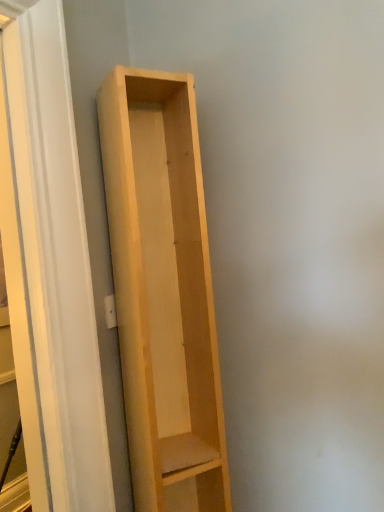
What do you see at coordinates (59, 259) in the screenshot?
I see `natural wood shelf at left` at bounding box center [59, 259].

Identify the location of natural wood shelf at left. The width and height of the screenshot is (384, 512). (59, 259).

Measure the distance between point (123, 140) and camera.

Point (123, 140) and camera are 1.00 meters apart from each other.

This screenshot has height=512, width=384. Identify the location of light wood shelf at center. (163, 291).

Image resolution: width=384 pixels, height=512 pixels. Describe the element at coordinates (163, 291) in the screenshot. I see `light wood shelf at center` at that location.

I want to click on natural wood shelf at left, so click(59, 259).

Can you confirm if light wood shelf at center is positioned to the right of natural wood shelf at left?

Correct, you'll find light wood shelf at center to the right of natural wood shelf at left.

Looking at this image, is light wood shelf at center positioned behind natural wood shelf at left?

Yes, it is behind natural wood shelf at left.

Between point (195, 360) and point (49, 36), which one is positioned behind?

The point (195, 360) is more distant.

From the image's perspective, is light wood shelf at center positioned above or below natural wood shelf at left?

light wood shelf at center is below natural wood shelf at left.

In the scene shown: From a real-world perspective, between light wood shelf at center and natural wood shelf at left, who is vertically higher?

natural wood shelf at left, from a real-world perspective.

Which object is thinner, light wood shelf at center or natural wood shelf at left?

With smaller width is natural wood shelf at left.

Who is shorter, light wood shelf at center or natural wood shelf at left?

With less height is light wood shelf at center.

Is light wood shelf at center bigger than natural wood shelf at left?

Correct, light wood shelf at center is larger in size than natural wood shelf at left.

Choose the correct answer: Is light wood shelf at center inside natural wood shelf at left or outside it?

light wood shelf at center is spatially situated outside natural wood shelf at left.

Are light wood shelf at center and natural wood shelf at left beside each other?

They are not placed beside each other.

Could you tell me if light wood shelf at center is facing natural wood shelf at left?

No, light wood shelf at center does not turn towards natural wood shelf at left.

This screenshot has height=512, width=384. I want to click on screen door above the light wood shelf at center (from a real-world perspective), so click(x=59, y=259).

Consider the image. In the image, is natural wood shelf at left on the left side or the right side of light wood shelf at center?

natural wood shelf at left is to the left of light wood shelf at center.

Is natural wood shelf at left closer to the viewer compared to light wood shelf at center?

Yes, it is in front of light wood shelf at center.

Is point (46, 429) positioned in front of point (203, 471)?

Yes.

From the image's perspective, which is above, natural wood shelf at left or light wood shelf at center?

From the image's view, natural wood shelf at left is above.

From a real-world perspective, between natural wood shelf at left and light wood shelf at center, who is vertically lower?

In real-world perspective, light wood shelf at center is lower.

Which of these two, natural wood shelf at left or light wood shelf at center, is wider?

light wood shelf at center.

Which of these two, natural wood shelf at left or light wood shelf at center, stands shorter?

light wood shelf at center.

Can you confirm if natural wood shelf at left is smaller than light wood shelf at center?

Indeed, natural wood shelf at left has a smaller size compared to light wood shelf at center.

Is light wood shelf at center completely or partially inside natural wood shelf at left?

No, natural wood shelf at left does not contain light wood shelf at center.

Would you consider natural wood shelf at left to be distant from light wood shelf at center?

No.

Is natural wood shelf at left facing away from light wood shelf at center?

natural wood shelf at left does not have its back to light wood shelf at center.

What's the angular difference between natural wood shelf at left and light wood shelf at center's facing directions?

They differ by 32.5 degrees in their facing directions.

I want to click on screen door in front of the light wood shelf at center, so click(x=59, y=259).

This screenshot has width=384, height=512. Find the location of `screen door located above the light wood shelf at center (from a real-world perspective)`. screen door located above the light wood shelf at center (from a real-world perspective) is located at coordinates (59, 259).

Locate an element on the screen. This screenshot has height=512, width=384. shelf on the right of natural wood shelf at left is located at coordinates (163, 291).